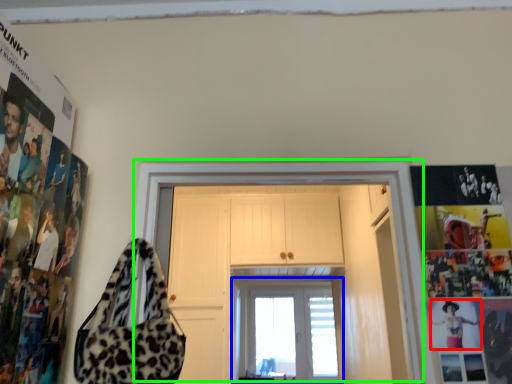
Question: Which is nearer to the person (highlighted by a red box)? window (highlighted by a blue box) or door (highlighted by a green box).

Choices:
 (A) window
 (B) door

Answer: (B)